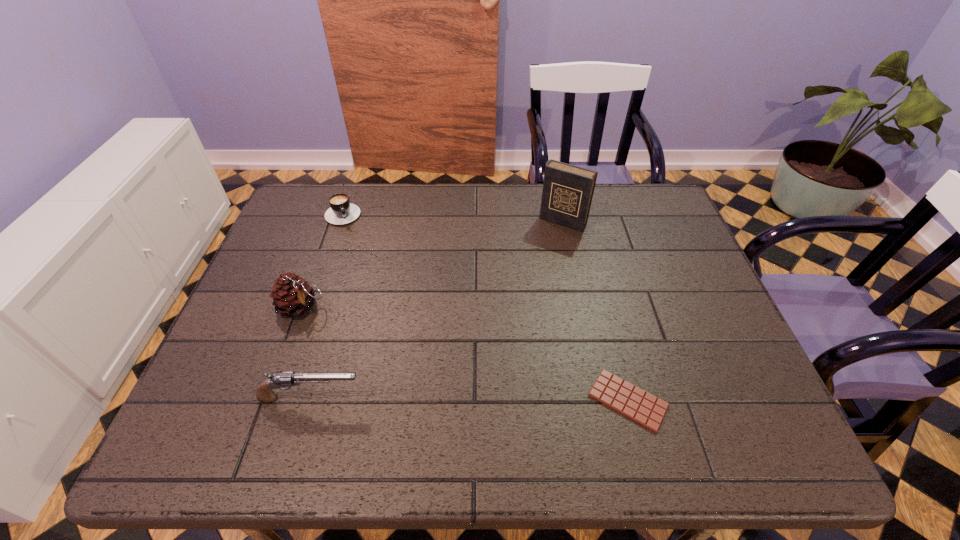
Where is `free spot between the third tallest object and the diary`? Image resolution: width=960 pixels, height=540 pixels. free spot between the third tallest object and the diary is located at coordinates [x=437, y=310].

Find the location of a particular element. This screenshot has width=960, height=540. empty space that is in between the third farthest object and the shortest object is located at coordinates (465, 353).

The image size is (960, 540). Identify the location of empty location between the shortest object and the cappuccino. (487, 305).

The height and width of the screenshot is (540, 960). What are the coordinates of `free space between the candy bar and the diary` in the screenshot? It's located at (595, 311).

The image size is (960, 540). What are the coordinates of `vacant space that's between the candy bar and the diary` in the screenshot? It's located at (595, 311).

I want to click on vacant area between the third shortest object and the candy bar, so click(469, 399).

At what (x,y) coordinates should I click in order to perform the action: click on vacant region between the diary and the third shortest object. Please return your answer as a coordinate pair (x, y). Looking at the image, I should click on (437, 310).

The height and width of the screenshot is (540, 960). Find the location of `vacant area between the cappuccino and the tallest object`. vacant area between the cappuccino and the tallest object is located at coordinates (454, 216).

Locate an element on the screen. The height and width of the screenshot is (540, 960). vacant area that lies between the tallest object and the pinecone is located at coordinates (432, 264).

I want to click on vacant space that is in between the diary and the third shortest object, so click(x=437, y=310).